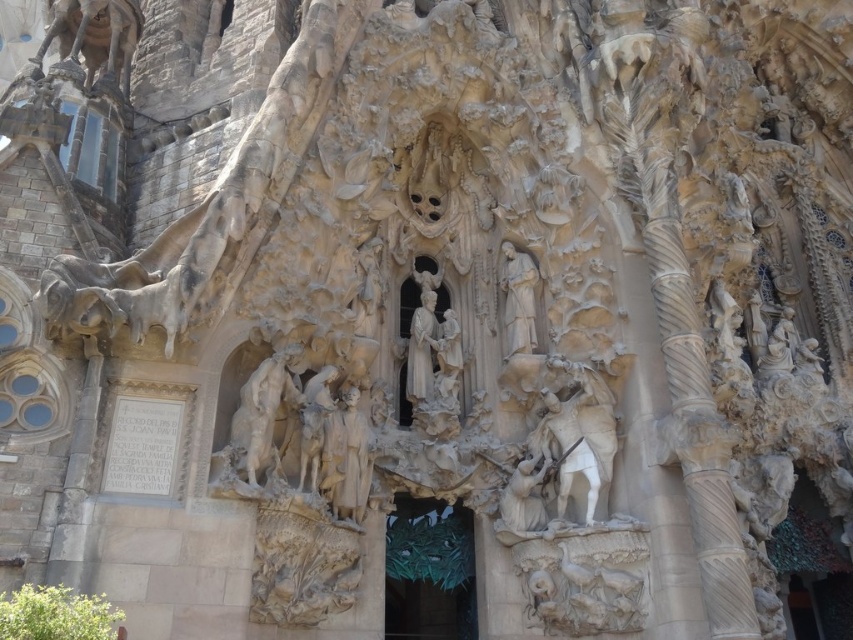
Question: Observing the image, what is the correct spatial positioning of white stone statue at center in reference to white stone statue at center-right?

Choices:
 (A) right
 (B) left

Answer: (B)

Question: Considering the relative positions of white marble horse at right and white stone statue at center-right in the image provided, where is white marble horse at right located with respect to white stone statue at center-right?

Choices:
 (A) right
 (B) left

Answer: (A)

Question: Which point is farther to the camera?

Choices:
 (A) (585, 385)
 (B) (511, 292)
 (C) (369, 477)
 (D) (241, 406)

Answer: (B)

Question: Which point is farther to the camera?

Choices:
 (A) (247, 381)
 (B) (550, 452)
 (C) (329, 454)
 (D) (518, 280)

Answer: (D)

Question: Does white marble horse at right have a lesser width compared to white stone statue at center-right?

Choices:
 (A) no
 (B) yes

Answer: (A)

Question: Which of the following is the farthest from the observer?

Choices:
 (A) white marble horse at right
 (B) white stone horse at center
 (C) white stone statue at center-right

Answer: (C)